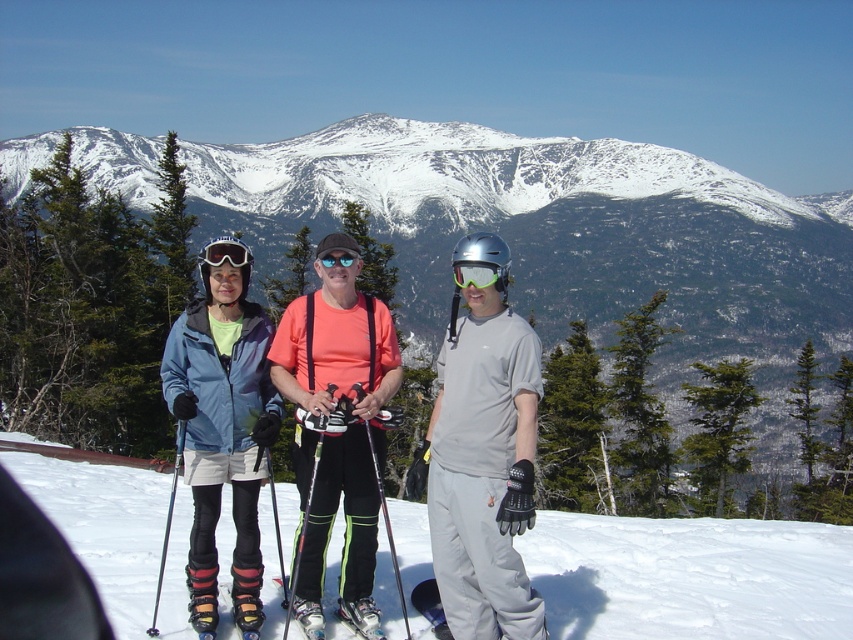
You are standing on the snowy slope and want to place a small flag at the point closer to the camera. Which point should you choose between point (427, 433) and point (200, 573)?

Point (427, 433) is further to the camera than point (200, 573), so you should choose point (427, 433) to place the flag closer to the camera.

You are a photographer trying to capture a photo of the snowy mountain at center and the blue reflective lens goggles at center. Which object should you focus on first if you want to ensure both are in the frame?

The snowy mountain at center is located above the blue reflective lens goggles at center, so you should focus on the snowy mountain at center first to ensure both are in the frame.